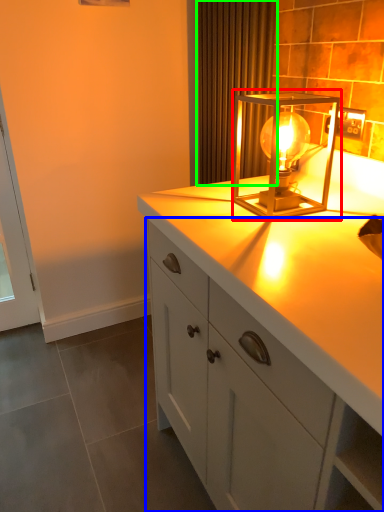
Question: Which object is the closest to the lamp (highlighted by a red box)? Choose among these: cabinetry (highlighted by a blue box) or curtain (highlighted by a green box).

Choices:
 (A) cabinetry
 (B) curtain

Answer: (B)